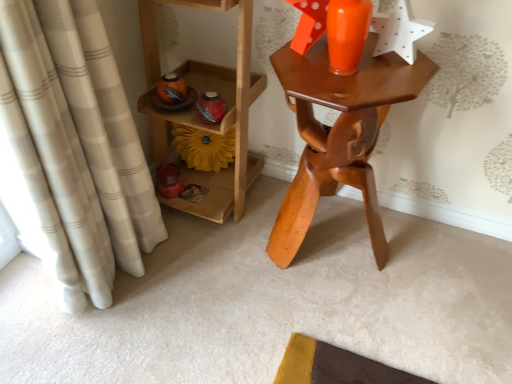
Locate an element on the screen. The image size is (512, 384). vacant area that lies in front of beige plaid curtain at left is located at coordinates (113, 346).